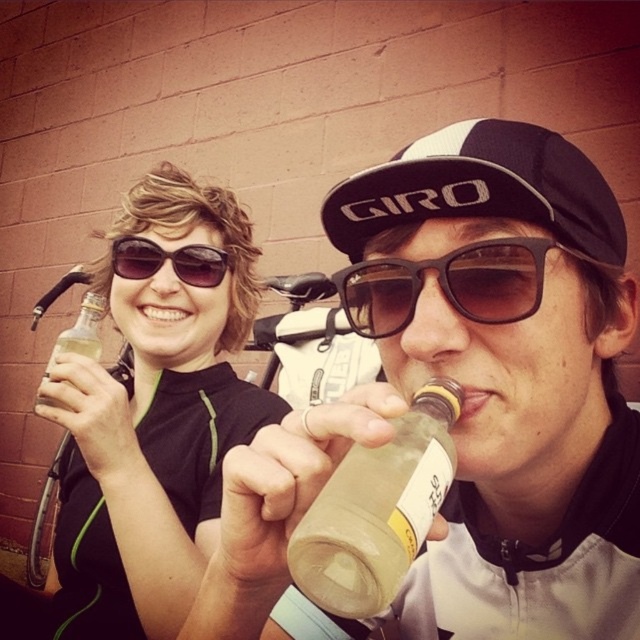
Is black mesh cap at center taller than translucent glass bottle at upper left?

No, black mesh cap at center is not taller than translucent glass bottle at upper left.

Measure the distance from black mesh cap at center to translucent glass bottle at upper left.

black mesh cap at center is 21.68 inches away from translucent glass bottle at upper left.

The height and width of the screenshot is (640, 640). I want to click on black mesh cap at center, so click(x=483, y=189).

Which of these two, black mesh cap at center or translucent glass bottle at center, stands taller?

With more height is black mesh cap at center.

Describe the element at coordinates (483, 189) in the screenshot. The image size is (640, 640). I see `black mesh cap at center` at that location.

Locate an element on the screen. This screenshot has height=640, width=640. black mesh cap at center is located at coordinates (483, 189).

From the picture: Is brown matte sunglasses at center smaller than translucent glass bottle at upper left?

Correct, brown matte sunglasses at center occupies less space than translucent glass bottle at upper left.

Which is in front, point (477, 317) or point (81, 320)?

Positioned in front is point (477, 317).

Does point (369, 316) lie behind point (48, 381)?

That is False.

Locate an element on the screen. This screenshot has width=640, height=640. brown matte sunglasses at center is located at coordinates (445, 284).